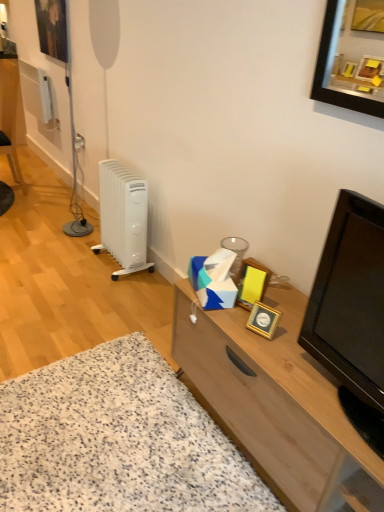
Question: Does wooden cabinet at center have a smaller size compared to white plastic radiator at left?

Choices:
 (A) no
 (B) yes

Answer: (A)

Question: Considering the relative positions of wooden cabinet at center and white plastic radiator at left in the image provided, is wooden cabinet at center to the right of white plastic radiator at left from the viewer's perspective?

Choices:
 (A) no
 (B) yes

Answer: (B)

Question: Can you confirm if wooden cabinet at center is wider than white plastic radiator at left?

Choices:
 (A) yes
 (B) no

Answer: (A)

Question: Is wooden cabinet at center beside white plastic radiator at left?

Choices:
 (A) yes
 (B) no

Answer: (B)

Question: From a real-world perspective, is wooden cabinet at center on white plastic radiator at left?

Choices:
 (A) no
 (B) yes

Answer: (A)

Question: From a real-world perspective, is matte black picture frame at upper left, marked as the 1th picture frame in a left-to-right arrangement, physically located above or below gold metallic picture frame at center-right, arranged as the third picture frame when viewed from the left?

Choices:
 (A) above
 (B) below

Answer: (A)

Question: Does point (52, 3) appear closer or farther from the camera than point (261, 313)?

Choices:
 (A) farther
 (B) closer

Answer: (A)

Question: Visually, is matte black picture frame at upper left, the first picture frame when ordered from back to front, positioned to the left or to the right of gold metallic picture frame at center-right, which ranks as the 1th picture frame in bottom-to-top order?

Choices:
 (A) right
 (B) left

Answer: (B)

Question: Based on their sizes in the image, would you say matte black picture frame at upper left, marked as the 1th picture frame in a left-to-right arrangement, is bigger or smaller than gold metallic picture frame at center-right, the 1th picture frame viewed from the front?

Choices:
 (A) big
 (B) small

Answer: (A)

Question: From a real-world perspective, is gold metallic picture frame at center-right, which ranks as the 1th picture frame in bottom-to-top order, above or below wooden cabinet at lower right?

Choices:
 (A) above
 (B) below

Answer: (A)

Question: From their relative heights in the image, would you say gold metallic picture frame at center-right, which ranks as the 1th picture frame in bottom-to-top order, is taller or shorter than wooden cabinet at lower right?

Choices:
 (A) tall
 (B) short

Answer: (A)

Question: Choose the correct answer: Is gold metallic picture frame at center-right, marked as the third picture frame in a back-to-front arrangement, inside wooden cabinet at lower right or outside it?

Choices:
 (A) inside
 (B) outside

Answer: (B)

Question: In the image, is gold metallic picture frame at center-right, the 1th picture frame viewed from the right, positioned in front of or behind wooden cabinet at lower right?

Choices:
 (A) behind
 (B) front

Answer: (A)

Question: Considering the positions of point (216, 433) and point (259, 290), is point (216, 433) closer or farther from the camera than point (259, 290)?

Choices:
 (A) farther
 (B) closer

Answer: (A)

Question: Relative to gold metallic picture frame at center-right, the second picture frame when ordered from right to left, is wooden cabinet at lower right in front or behind?

Choices:
 (A) behind
 (B) front

Answer: (B)